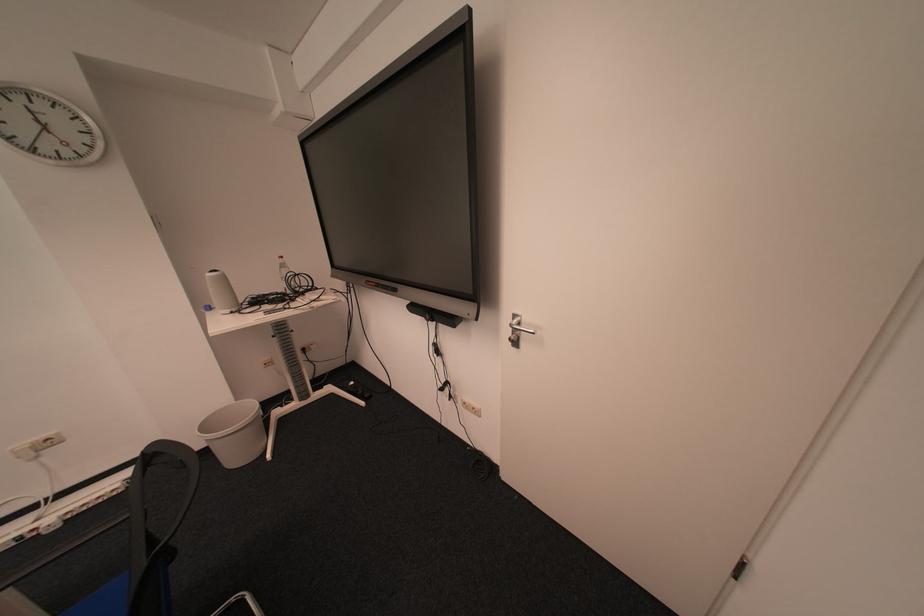
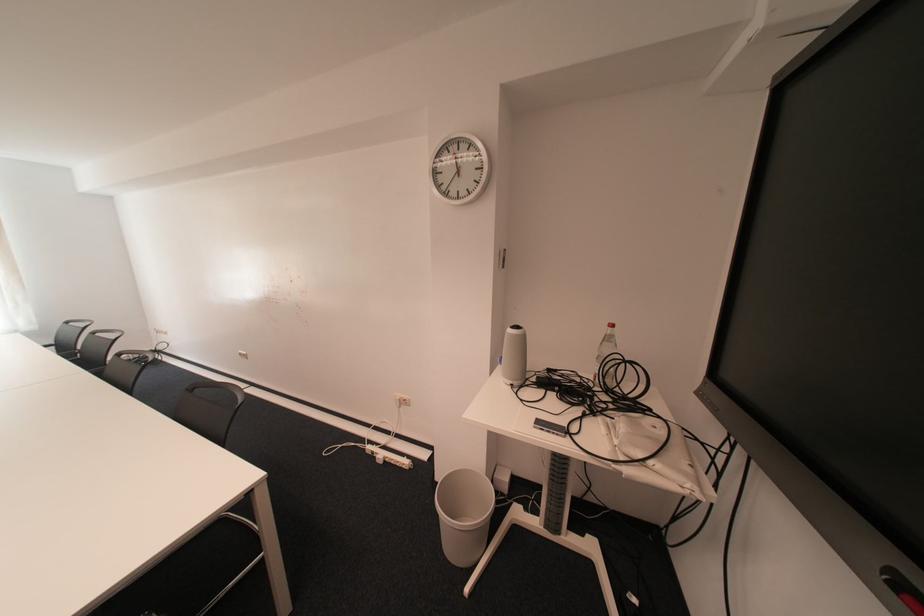
Find the pixel in the second image that matches pixel 239 312 in the first image.

(520, 383)